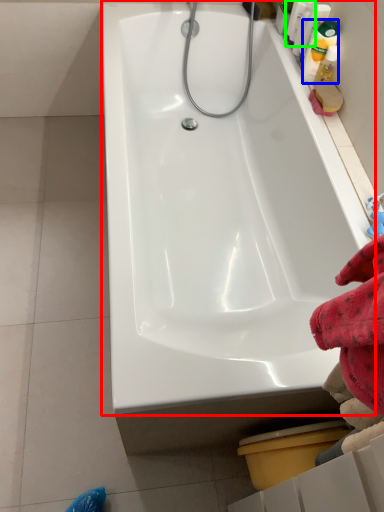
Question: Which is nearer to the bathtub (highlighted by a red box)? cleaning product (highlighted by a blue box) or cleaning product (highlighted by a green box).

Choices:
 (A) cleaning product
 (B) cleaning product

Answer: (A)